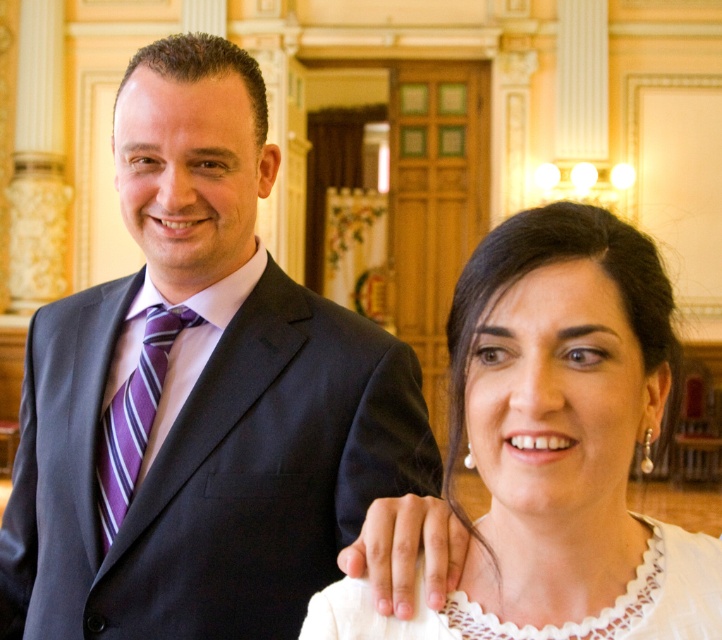
Question: Which of the following is the farthest from the observer?

Choices:
 (A) white lace blouse at center
 (B) purple striped tie at left
 (C) matte black suit at center
 (D) white lace dress at center

Answer: (B)

Question: Does matte black suit at center have a lesser width compared to white lace dress at center?

Choices:
 (A) no
 (B) yes

Answer: (A)

Question: Can you confirm if white lace dress at center is bigger than purple striped tie at left?

Choices:
 (A) no
 (B) yes

Answer: (B)

Question: Which of the following is the closest to the observer?

Choices:
 (A) (596, 218)
 (B) (126, 324)
 (C) (136, 385)

Answer: (A)

Question: Observing the image, what is the correct spatial positioning of white lace blouse at center in reference to purple striped tie at left?

Choices:
 (A) above
 (B) below

Answer: (B)

Question: Considering the real-world distances, which object is closest to the matte black suit at center?

Choices:
 (A) white lace dress at center
 (B) purple striped tie at left

Answer: (B)